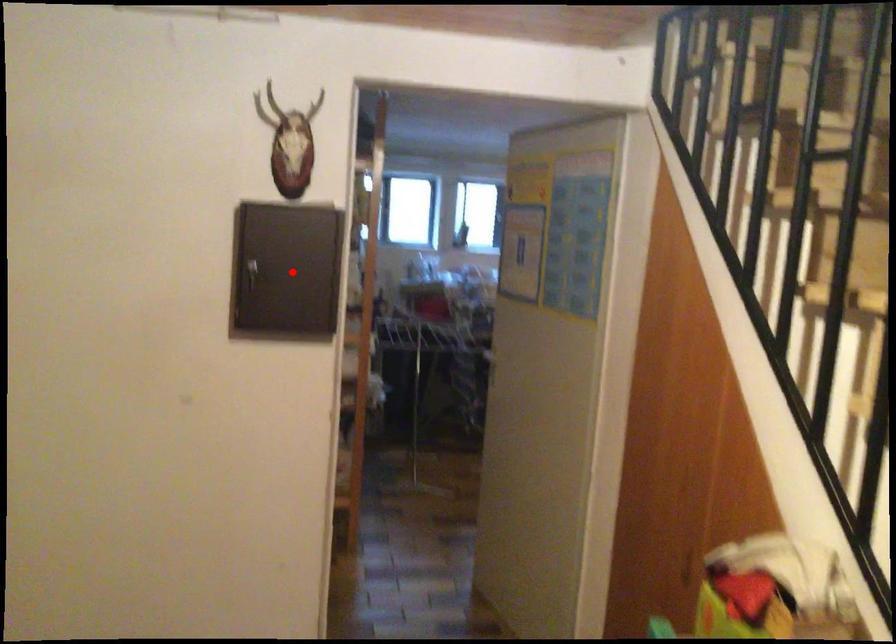
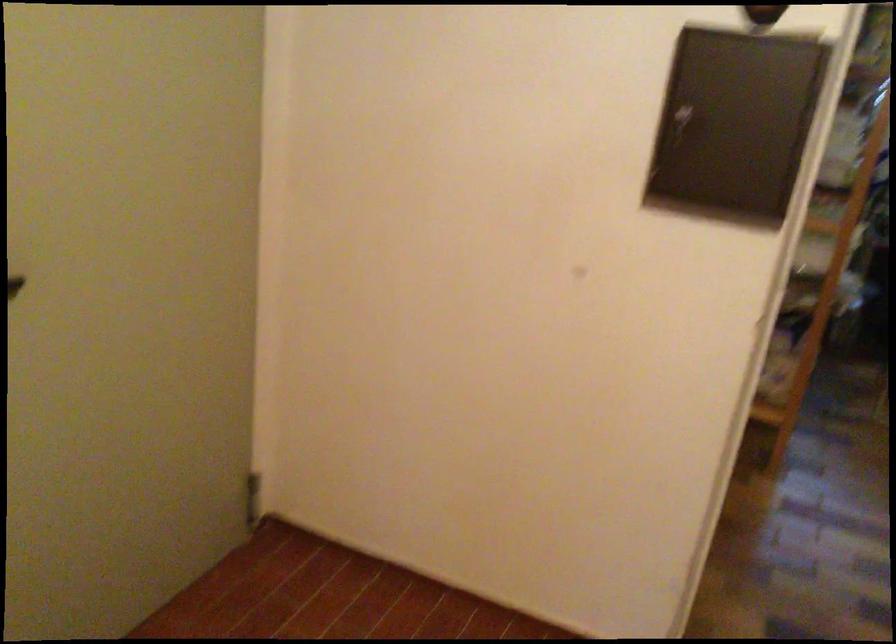
Locate, in the second image, the point that corresponds to the highlighted location in the first image.

(734, 122)